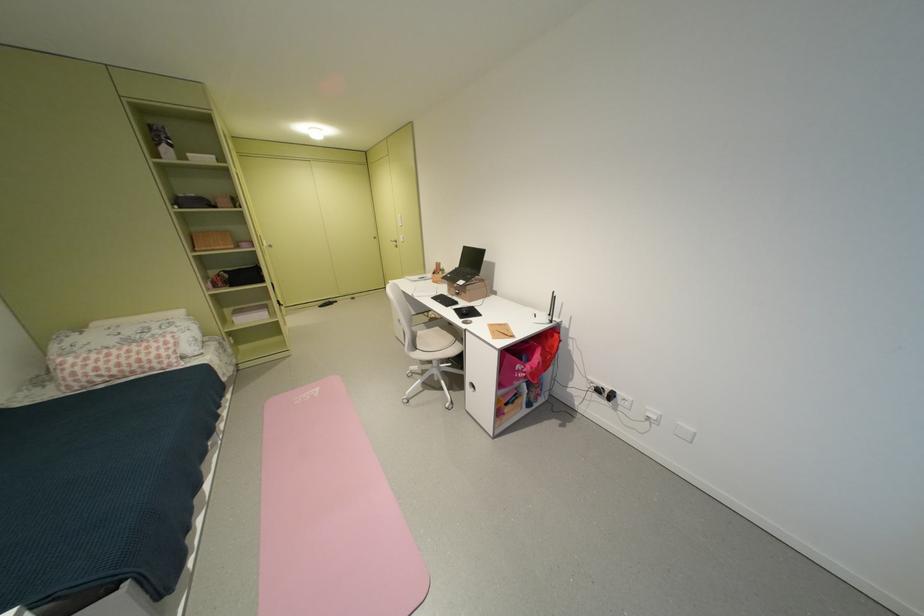
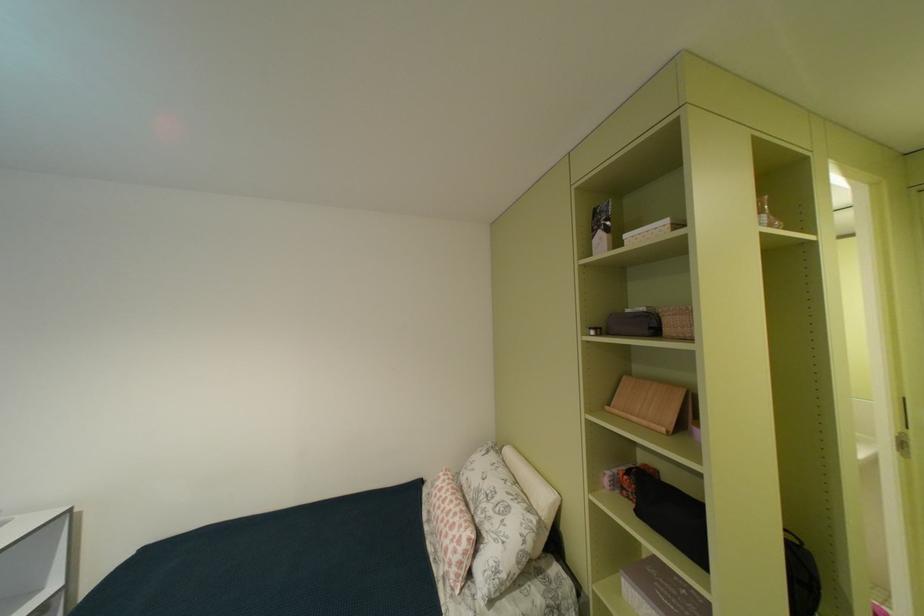
Find the pixel in the second image that matches the point at 128,341 in the first image.

(487, 487)